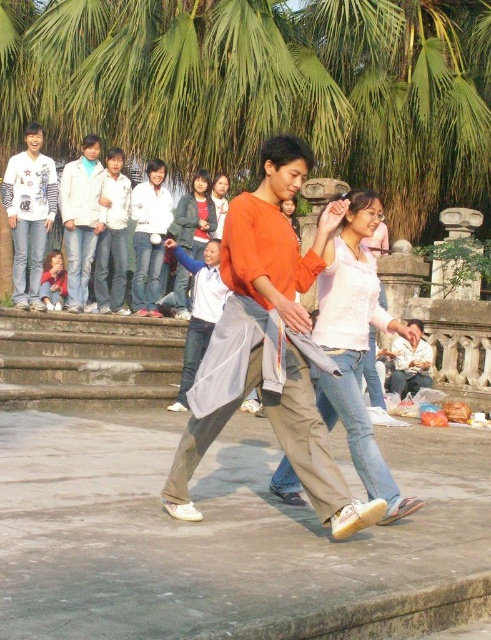
You are standing at the center of the plaza and see the light pink fabric shirt at center. According to the coordinates provided, is the shirt positioned more to the left or right side of the plaza?

The light pink fabric shirt at center is located at point 0.539 on the x and y axis, which means it is positioned slightly to the right side of the plaza.

Based on the coordinates provided, where exactly is the white matte jacket at center located in the image?

The white matte jacket at center is located at the 2D coordinates point (149, 237).

You are standing at the center of the plaza and want to greet both people in the image. The person wearing the matte orange shirt at center is your friend, and the person wearing the white cotton shirt at lower right is a stranger. If you walk straight towards the stranger, will you pass by your friend first before reaching them?

The white cotton shirt at lower right is 11.18 feet from matte orange shirt at center. Since you are starting at the center, walking towards the stranger would mean moving away from your friend, so you would not pass by them first. You would reach the stranger directly without passing your friend.